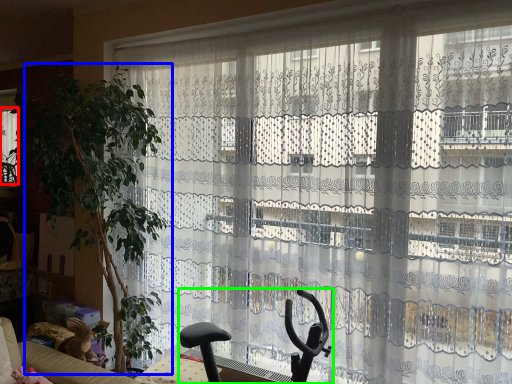
Question: Which object is positioned farthest from window (highlighted by a red box)? Select from plant (highlighted by a blue box) and swivel chair (highlighted by a green box).

Choices:
 (A) plant
 (B) swivel chair

Answer: (B)